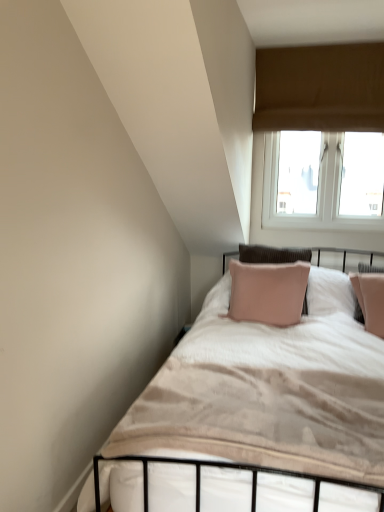
Question: Could velvet beige bed at center be considered to be inside brown fabric window at upper right?

Choices:
 (A) no
 (B) yes

Answer: (A)

Question: Is brown fabric window at upper right not within velvet beige bed at center?

Choices:
 (A) yes
 (B) no

Answer: (A)

Question: Is brown fabric window at upper right facing towards velvet beige bed at center?

Choices:
 (A) no
 (B) yes

Answer: (B)

Question: Can you confirm if brown fabric window at upper right is taller than velvet beige bed at center?

Choices:
 (A) no
 (B) yes

Answer: (B)

Question: From a real-world perspective, does brown fabric window at upper right sit lower than velvet beige bed at center?

Choices:
 (A) no
 (B) yes

Answer: (A)

Question: From the image's perspective, does brown fabric window at upper right appear lower than velvet beige bed at center?

Choices:
 (A) yes
 (B) no

Answer: (B)

Question: Considering the relative positions of velvet beige bed at center and brown fabric window at upper right in the image provided, is velvet beige bed at center to the left of brown fabric window at upper right from the viewer's perspective?

Choices:
 (A) yes
 (B) no

Answer: (A)

Question: From the image's perspective, is velvet beige bed at center above brown fabric window at upper right?

Choices:
 (A) yes
 (B) no

Answer: (B)

Question: Does velvet beige bed at center have a lesser width compared to brown fabric window at upper right?

Choices:
 (A) no
 (B) yes

Answer: (A)

Question: Considering the relative positions of velvet beige bed at center and brown fabric window at upper right in the image provided, is velvet beige bed at center to the right of brown fabric window at upper right from the viewer's perspective?

Choices:
 (A) no
 (B) yes

Answer: (A)

Question: Is brown fabric window at upper right at the back of velvet beige bed at center?

Choices:
 (A) yes
 (B) no

Answer: (B)

Question: Is the position of velvet beige bed at center more distant than that of brown fabric window at upper right?

Choices:
 (A) yes
 (B) no

Answer: (B)

Question: From the image's perspective, is velvet beige bed at center above or below brown fabric window at upper right?

Choices:
 (A) above
 (B) below

Answer: (B)